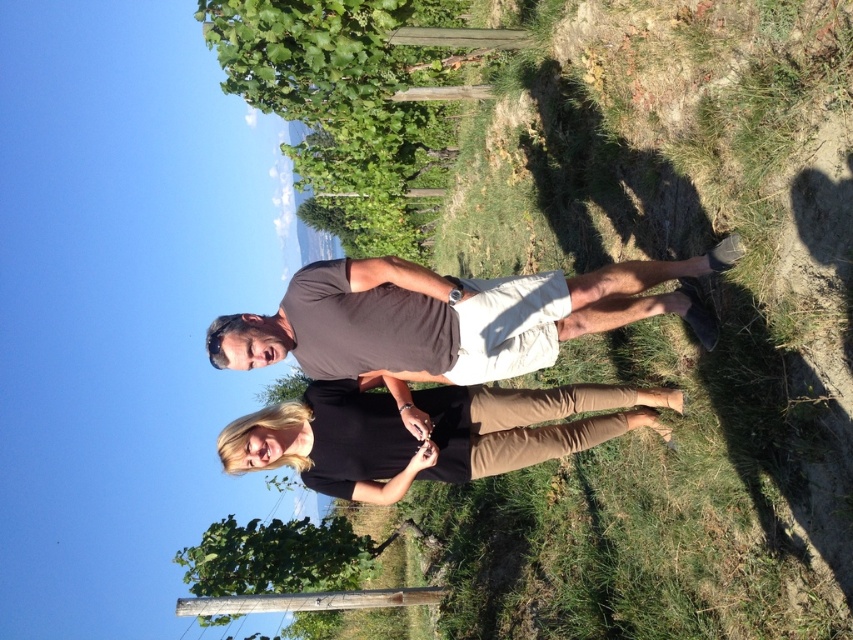
Question: Can you confirm if matte brown t-shirt at center is positioned below black cotton shirt at center?

Choices:
 (A) no
 (B) yes

Answer: (A)

Question: Is matte brown t-shirt at center wider than black cotton shirt at center?

Choices:
 (A) yes
 (B) no

Answer: (A)

Question: Which point is closer to the camera?

Choices:
 (A) black cotton shirt at center
 (B) matte brown t-shirt at center

Answer: (B)

Question: Which of the following is the closest to the observer?

Choices:
 (A) (355, 294)
 (B) (447, 436)

Answer: (A)

Question: Observing the image, what is the correct spatial positioning of matte brown t-shirt at center in reference to black cotton shirt at center?

Choices:
 (A) above
 (B) below

Answer: (A)